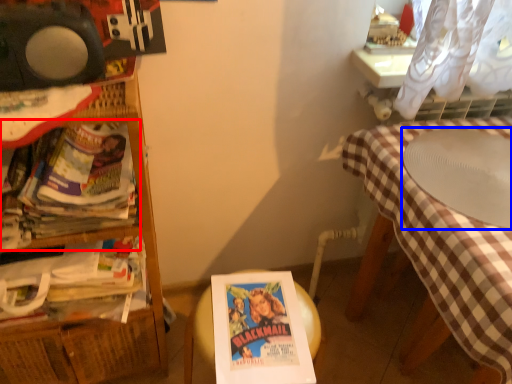
Question: Which of the following is the farthest to the observer, book (highlighted by a red box) or round table (highlighted by a blue box)?

Choices:
 (A) book
 (B) round table

Answer: (B)